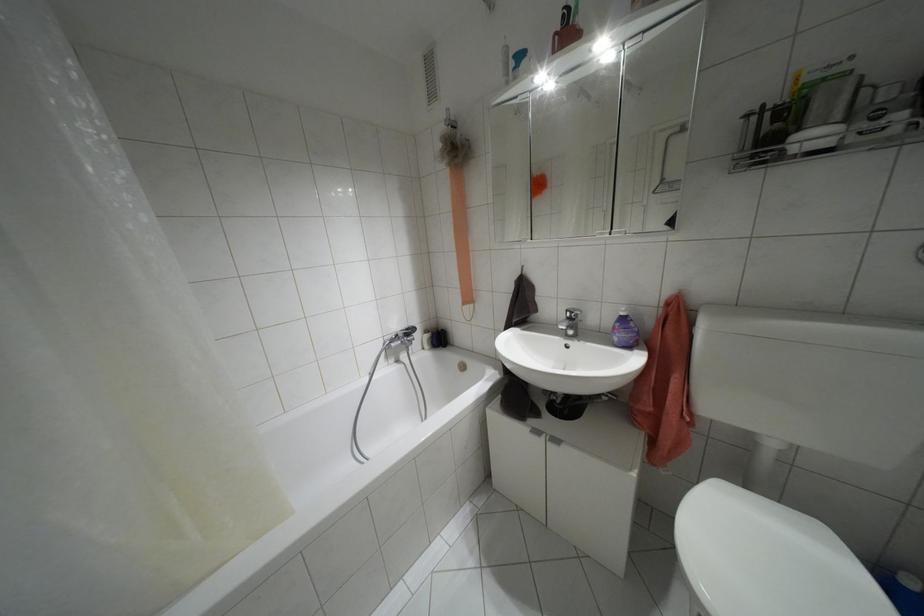
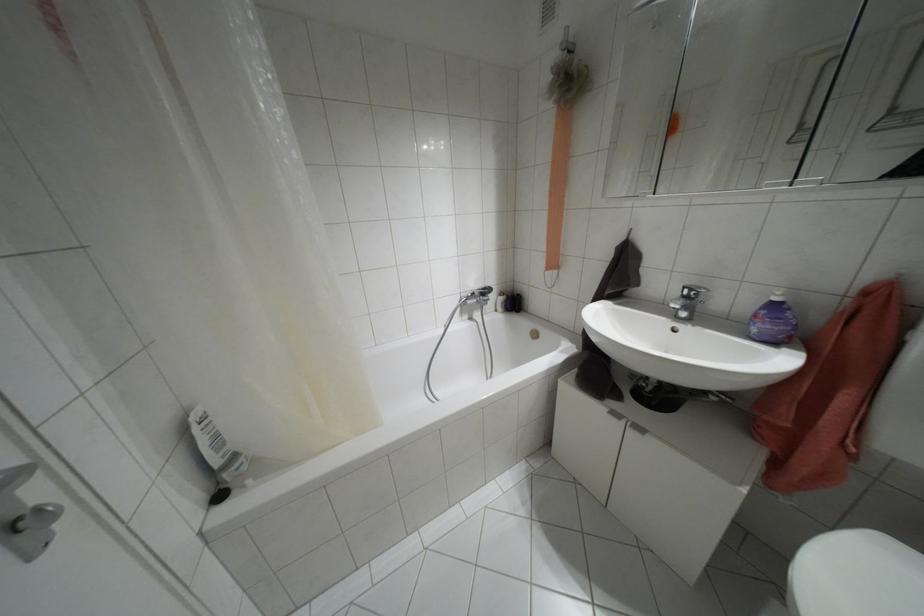
Question: Which direction would the cameraman need to move to produce the second image? Reply with the corresponding letter.

Choices:
 (A) Left
 (B) Right
 (C) Forward
 (D) Backward

Answer: (A)